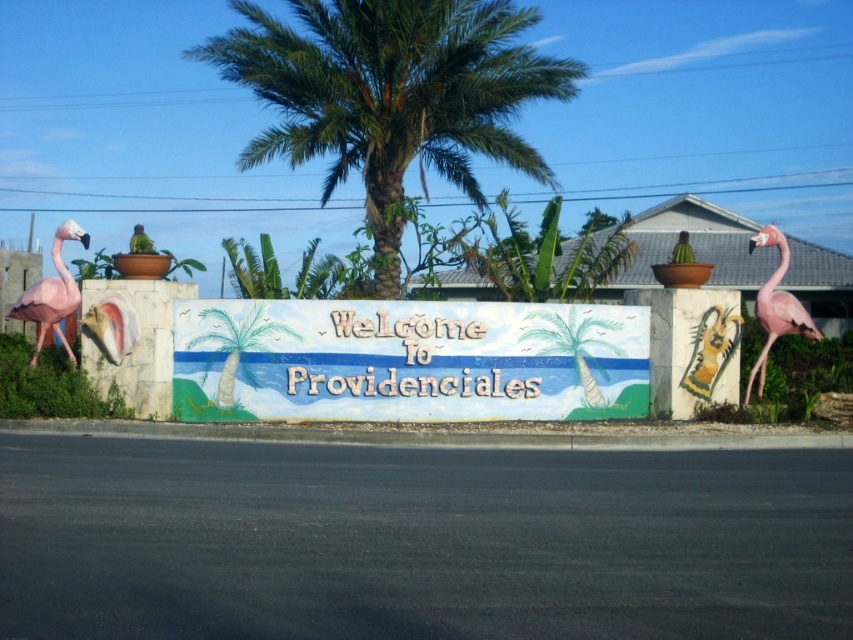
You are standing at the base of the green leafy palm tree at center and want to place a decorative pink flamingo on each side of the sign. How far apart should you position the two flamingos to maintain symmetry?

The two decorative pink flamingos should be placed 72.24 feet apart to maintain symmetry.

You are a photographer planning to take a photo of the painted wooden signboard at center and the pink matte flamingo at left. If you want the flamingo to appear smaller in the photo, should you move closer to or farther away from the signboard?

To make the pink matte flamingo at left appear smaller in the photo, you should move farther away from the painted wooden signboard at center. Since the pink matte flamingo at left is behind the signboard, increasing the distance between the camera and the signboard will reduce the relative size of the flamingo in the frame.